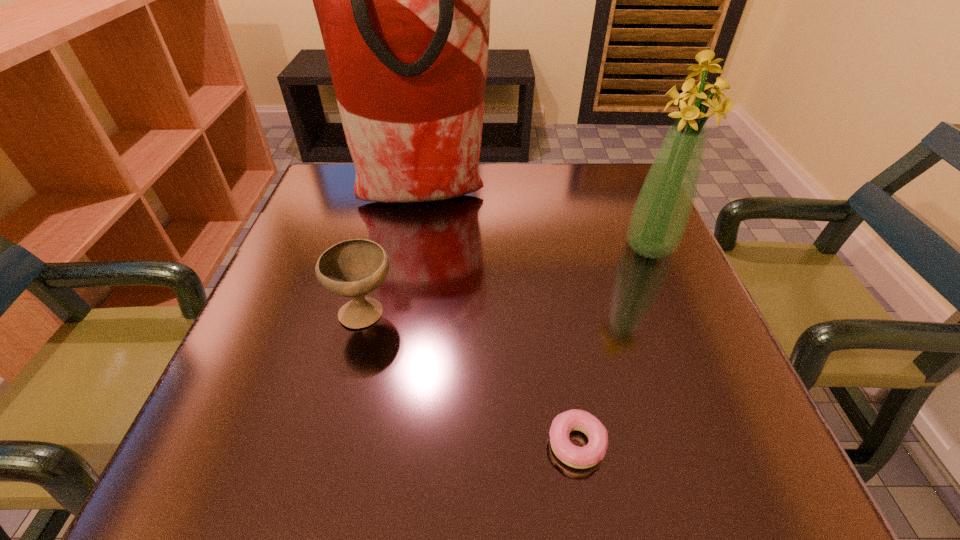
The width and height of the screenshot is (960, 540). Identify the location of free area in between the third farthest object and the nearest object. tap(470, 378).

Find the location of a particular element. This screenshot has width=960, height=540. free spot between the rightmost object and the nearest object is located at coordinates (613, 346).

Where is `free space between the second nearest object and the grocery bag`? free space between the second nearest object and the grocery bag is located at coordinates (395, 255).

At what (x,y) coordinates should I click in order to perform the action: click on free spot between the shortest object and the third tallest object. Please return your answer as a coordinate pair (x, y). Looking at the image, I should click on (470, 378).

Image resolution: width=960 pixels, height=540 pixels. I want to click on vacant area that lies between the grocery bag and the doughnut, so click(x=500, y=321).

At what (x,y) coordinates should I click in order to perform the action: click on object identified as the second closest to the shortest object. Please return your answer as a coordinate pair (x, y). The image size is (960, 540). Looking at the image, I should click on (659, 218).

Locate an element on the screen. object that stands as the closest to the rightmost object is located at coordinates (403, 0).